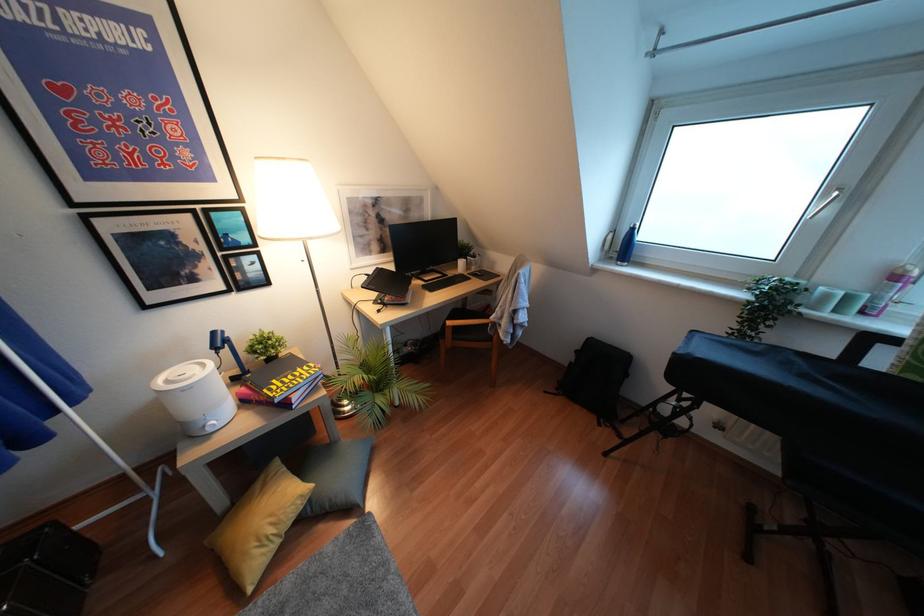
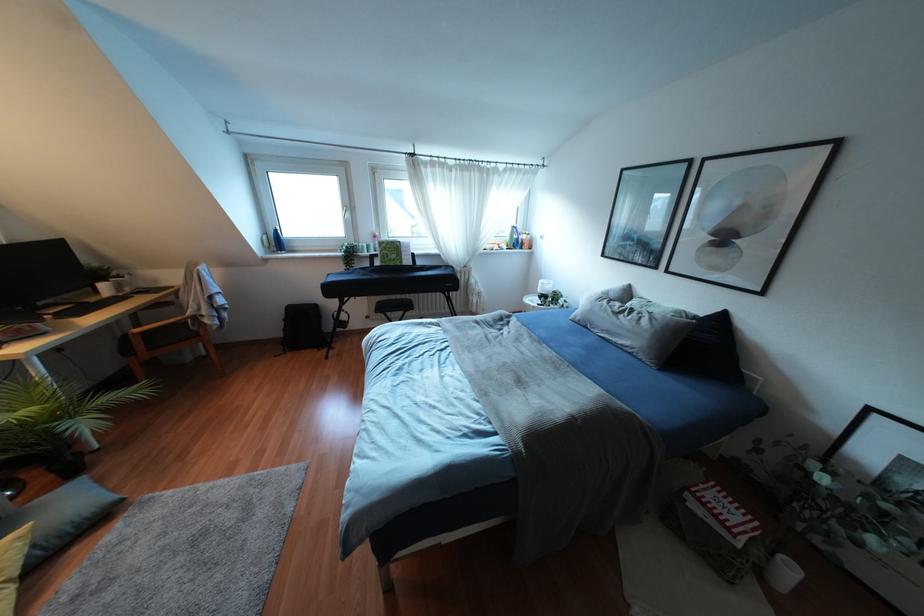
The point at (x=623, y=246) is marked in the first image. Where is the corresponding point in the second image?

(275, 241)